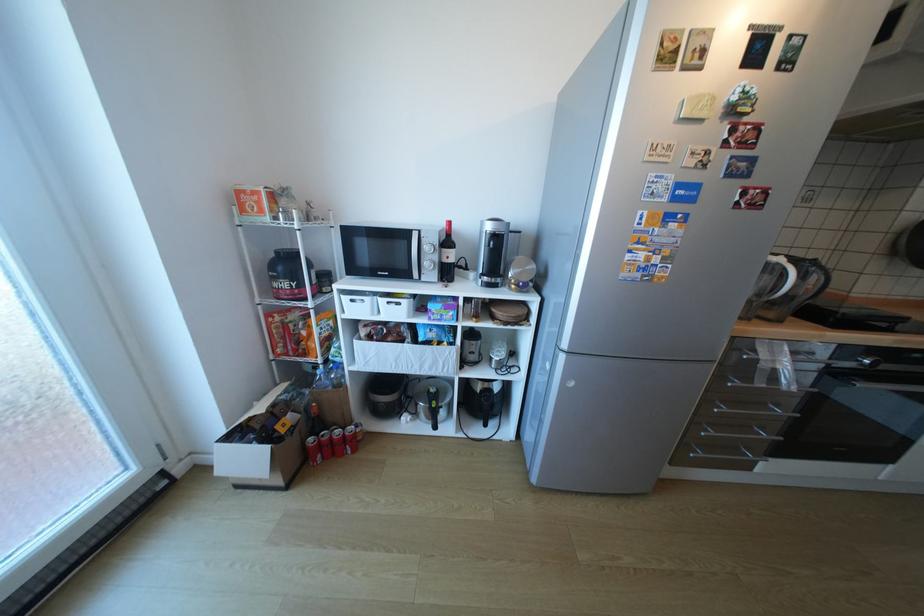
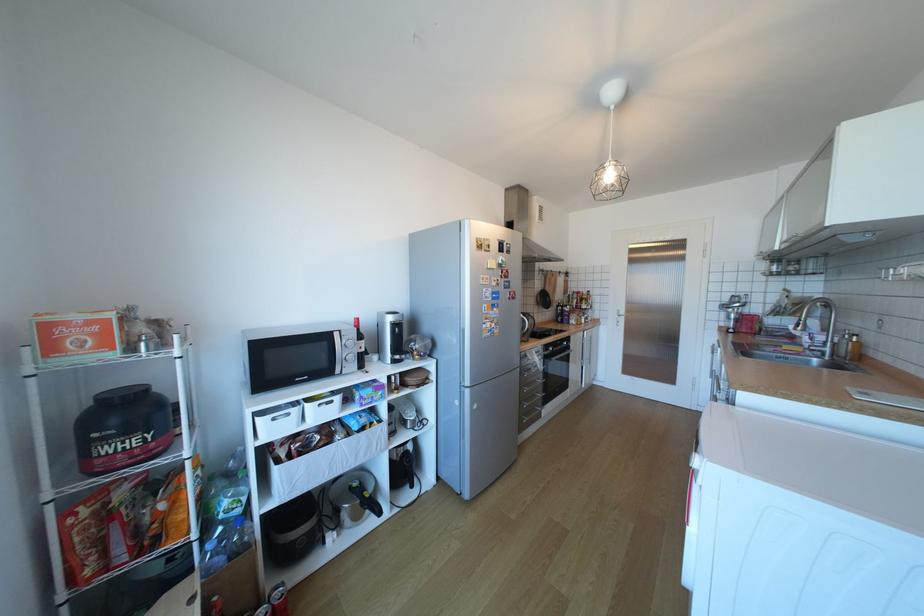
Locate, in the second image, the point that corresponds to the point at 494,424 in the first image.

(420, 485)